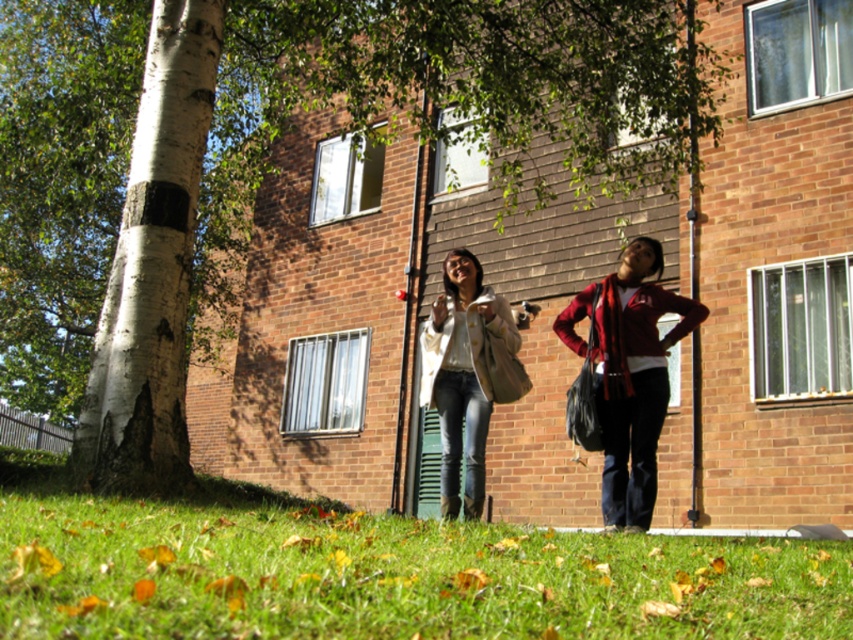
Can you confirm if white bark tree at left is shorter than red plaid scarf at lower right?

In fact, white bark tree at left may be taller than red plaid scarf at lower right.

In the scene shown: Does white bark tree at left have a greater height compared to red plaid scarf at lower right?

Yes, white bark tree at left is taller than red plaid scarf at lower right.

Is point (665, 113) closer to camera compared to point (636, 506)?

That is False.

At what (x,y) coordinates should I click in order to perform the action: click on white bark tree at left. Please return your answer as a coordinate pair (x, y). Looking at the image, I should click on (271, 161).

Does green grass at lower center have a larger size compared to white matte jacket at center?

No, green grass at lower center is not bigger than white matte jacket at center.

Can you confirm if green grass at lower center is positioned to the left of white matte jacket at center?

Correct, you'll find green grass at lower center to the left of white matte jacket at center.

Is point (267, 616) behind point (467, 310)?

No, (267, 616) is in front of (467, 310).

Locate an element on the screen. green grass at lower center is located at coordinates (381, 573).

Looking at this image, does red plaid scarf at lower right have a lesser height compared to white matte jacket at center?

No, red plaid scarf at lower right is not shorter than white matte jacket at center.

Is red plaid scarf at lower right positioned in front of white matte jacket at center?

Yes, red plaid scarf at lower right is closer to the viewer.

Find the location of a particular element. red plaid scarf at lower right is located at coordinates (630, 374).

Find the location of a particular element. This screenshot has height=640, width=853. red plaid scarf at lower right is located at coordinates (630, 374).